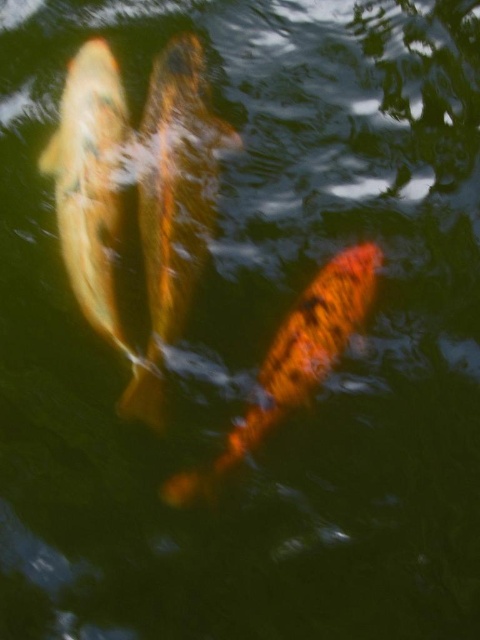
Where is `shiny gold fish at center`? shiny gold fish at center is located at coordinates (173, 204).

Who is more forward, (228, 125) or (127, 109)?

Positioned in front is point (127, 109).

In order to click on shiny gold fish at center in this screenshot , I will do `click(173, 204)`.

Which is in front, point (122, 93) or point (289, 337)?

Point (289, 337) is more forward.

Which is behind, point (83, 144) or point (267, 358)?

Point (83, 144)

Does point (99, 276) lie in front of point (261, 372)?

No, (99, 276) is further to viewer.

Where is `shiny gold fish at left`? shiny gold fish at left is located at coordinates (95, 198).

Can you confirm if shiny gold fish at center is wider than shiny orange fish at center?

No, shiny gold fish at center is not wider than shiny orange fish at center.

Does shiny gold fish at center appear over shiny orange fish at center?

Yes, shiny gold fish at center is above shiny orange fish at center.

Is point (207, 241) closer to viewer compared to point (290, 371)?

No, (207, 241) is further to viewer.

Locate an element on the screen. shiny gold fish at center is located at coordinates (173, 204).